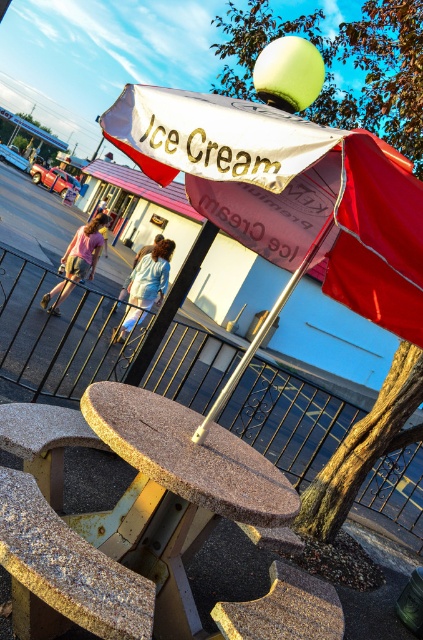
You are standing at the entrance of the Klub Premium Ice Cream shop and see two points marked on the ground. The first point is at coordinate point (280, 294) and the second is at point (280, 515). If you want to place a new bench between them, which point should you start from to ensure the bench is closer to the entrance?

You should start placing the bench from point (280, 294) because it is closer to the entrance than point (280, 515).

You are standing at the entrance of the Klub Premium Ice Cream shop and see the point marked at coordinates (x=288, y=193). What object is located at that point?

The point at coordinates (x=288, y=193) indicates the white fabric umbrella at center.